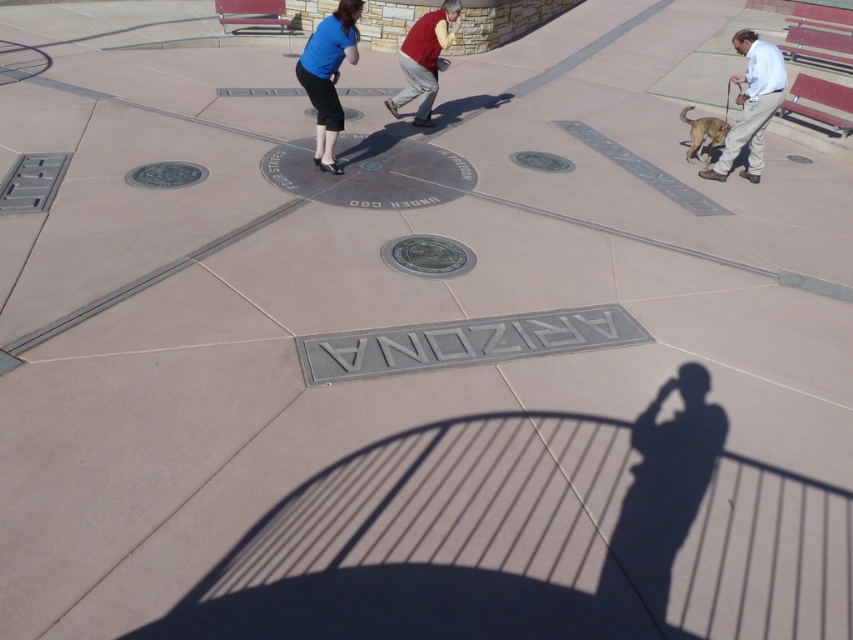
Question: Among these points, which one is farthest from the camera?

Choices:
 (A) (699, 499)
 (B) (751, 83)
 (C) (305, 56)

Answer: (B)

Question: Which point is closer to the camera?

Choices:
 (A) silhouette shadow at center
 (B) matte blue skirt at upper center
 (C) light beige pants at right

Answer: (A)

Question: Considering the real-world distances, which object is closest to the matte blue skirt at upper center?

Choices:
 (A) silhouette shadow at center
 (B) matte red shirt at center
 (C) light beige pants at right

Answer: (B)

Question: From the image, what is the correct spatial relationship of matte blue skirt at upper center in relation to matte red shirt at center?

Choices:
 (A) left
 (B) right

Answer: (A)

Question: Is silhouette shadow at center thinner than light beige pants at right?

Choices:
 (A) no
 (B) yes

Answer: (A)

Question: Considering the relative positions of silhouette shadow at center and light beige pants at right in the image provided, where is silhouette shadow at center located with respect to light beige pants at right?

Choices:
 (A) above
 (B) below

Answer: (B)